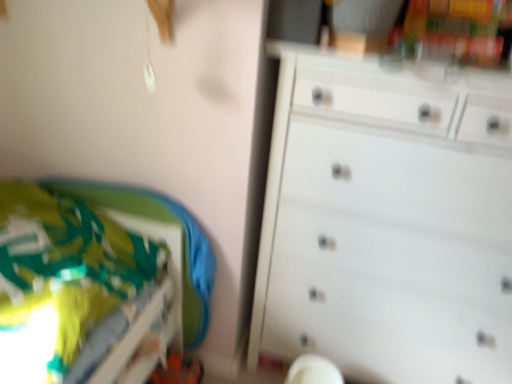
Question: Is white plastic swivel chair at lower center aimed at green fabric bed at lower left?

Choices:
 (A) no
 (B) yes

Answer: (A)

Question: Does white plastic swivel chair at lower center have a larger size compared to green fabric bed at lower left?

Choices:
 (A) yes
 (B) no

Answer: (B)

Question: Does white plastic swivel chair at lower center have a lesser height compared to green fabric bed at lower left?

Choices:
 (A) yes
 (B) no

Answer: (A)

Question: Is white plastic swivel chair at lower center touching green fabric bed at lower left?

Choices:
 (A) no
 (B) yes

Answer: (A)

Question: Does white plastic swivel chair at lower center appear on the right side of green fabric bed at lower left?

Choices:
 (A) yes
 (B) no

Answer: (A)

Question: From a real-world perspective, is white plastic swivel chair at lower center positioned above or below green fabric bed at lower left?

Choices:
 (A) above
 (B) below

Answer: (B)

Question: From the image's perspective, relative to green fabric bed at lower left, is white plastic swivel chair at lower center above or below?

Choices:
 (A) above
 (B) below

Answer: (B)

Question: Is white plastic swivel chair at lower center taller or shorter than green fabric bed at lower left?

Choices:
 (A) tall
 (B) short

Answer: (B)

Question: In terms of size, does white plastic swivel chair at lower center appear bigger or smaller than green fabric bed at lower left?

Choices:
 (A) big
 (B) small

Answer: (B)

Question: Considering the positions of white matte chest of drawers at right and green fabric bed at lower left in the image, is white matte chest of drawers at right wider or thinner than green fabric bed at lower left?

Choices:
 (A) wide
 (B) thin

Answer: (B)

Question: In terms of size, does white matte chest of drawers at right appear bigger or smaller than green fabric bed at lower left?

Choices:
 (A) small
 (B) big

Answer: (B)

Question: Considering the positions of white matte chest of drawers at right and green fabric bed at lower left in the image, is white matte chest of drawers at right taller or shorter than green fabric bed at lower left?

Choices:
 (A) tall
 (B) short

Answer: (A)

Question: From the image's perspective, is white matte chest of drawers at right positioned above or below green fabric bed at lower left?

Choices:
 (A) below
 (B) above

Answer: (B)

Question: Which is correct: white matte chest of drawers at right is inside white plastic swivel chair at lower center, or outside of it?

Choices:
 (A) outside
 (B) inside

Answer: (A)

Question: Considering the positions of point (399, 187) and point (335, 367), is point (399, 187) closer or farther from the camera than point (335, 367)?

Choices:
 (A) closer
 (B) farther

Answer: (A)